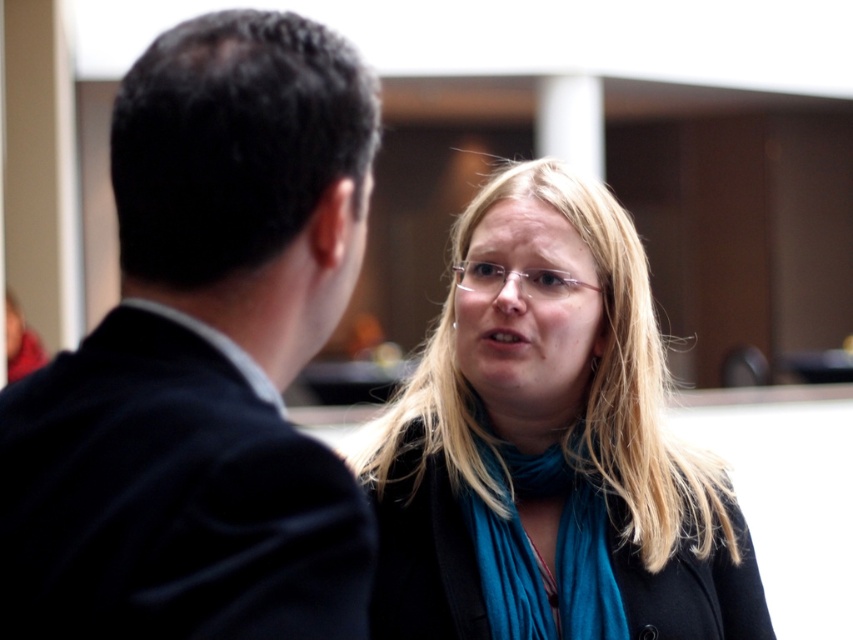
Who is higher up, blue fabric scarf at center or teal soft fabric scarf at center?

blue fabric scarf at center is above.

From the picture: Which is below, blue fabric scarf at center or teal soft fabric scarf at center?

Positioned lower is teal soft fabric scarf at center.

Identify the location of blue fabric scarf at center. This screenshot has height=640, width=853. coord(550,445).

Find the location of `blue fabric scarf at center`. blue fabric scarf at center is located at coordinates (550, 445).

Who is taller, black suit at left or blue fabric scarf at center?

Standing taller between the two is blue fabric scarf at center.

Does black suit at left appear over blue fabric scarf at center?

Yes, black suit at left is above blue fabric scarf at center.

At what (x,y) coordinates should I click in order to perform the action: click on black suit at left. Please return your answer as a coordinate pair (x, y). Looking at the image, I should click on (202, 358).

Is point (328, 497) less distant than point (410, 634)?

That is True.

Can you confirm if black suit at left is smaller than matte black coat at center?

Correct, black suit at left occupies less space than matte black coat at center.

What do you see at coordinates (202, 358) in the screenshot?
I see `black suit at left` at bounding box center [202, 358].

The width and height of the screenshot is (853, 640). In order to click on black suit at left in this screenshot , I will do `click(202, 358)`.